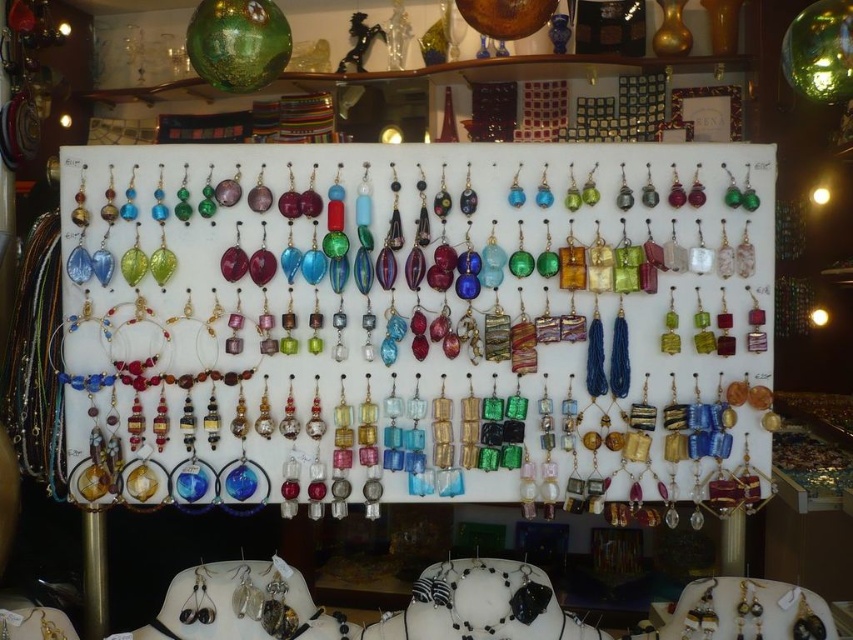
Question: Which point appears farthest from the camera in this image?

Choices:
 (A) (686, 182)
 (B) (26, 609)

Answer: (A)

Question: Is translucent glass earrings at center wider than gold metallic necklace at lower left?

Choices:
 (A) no
 (B) yes

Answer: (B)

Question: Where is translucent glass earrings at center located in relation to gold metallic necklace at lower left in the image?

Choices:
 (A) right
 (B) left

Answer: (A)

Question: Which of the following is the closest to the observer?

Choices:
 (A) gold metallic necklace at lower left
 (B) translucent glass earrings at center

Answer: (A)

Question: Which object appears closest to the camera in this image?

Choices:
 (A) gold metallic necklace at lower left
 (B) translucent glass earrings at center

Answer: (A)

Question: Is translucent glass earrings at center wider than gold metallic necklace at lower left?

Choices:
 (A) yes
 (B) no

Answer: (A)